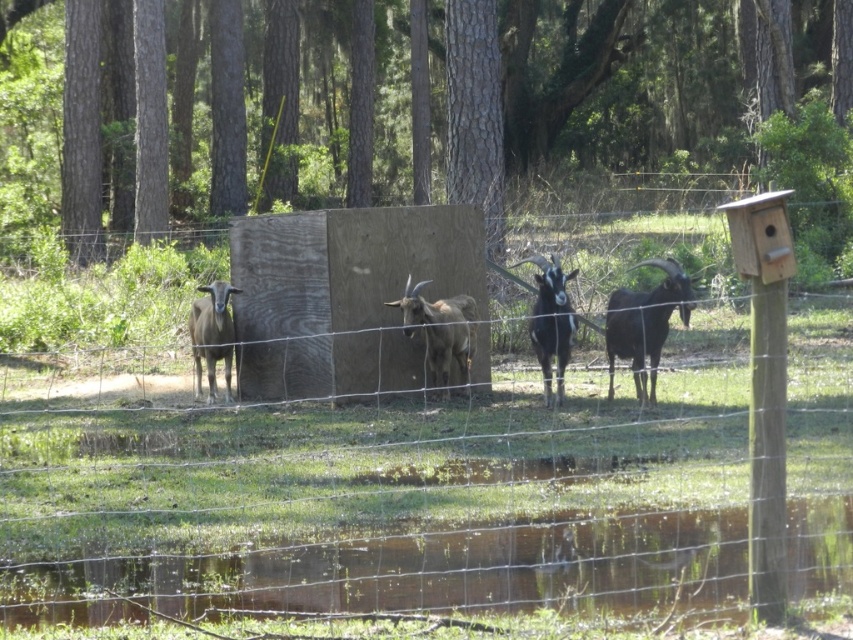
Question: Which point is farther to the camera?

Choices:
 (A) brown woolen goats at center
 (B) wooden fence at center
 (C) black woolly goat at right

Answer: (A)

Question: Is wooden fence at center to the right of brown woolly goat at left from the viewer's perspective?

Choices:
 (A) no
 (B) yes

Answer: (B)

Question: Among these points, which one is nearest to the camera?

Choices:
 (A) (659, 336)
 (B) (515, 266)
 (C) (688, 310)
 (D) (447, 307)

Answer: (C)

Question: Is brown woolen goat at center above black woolen goat at center?

Choices:
 (A) yes
 (B) no

Answer: (B)

Question: Does brown woolen goats at center have a greater width compared to brown woolly goat at left?

Choices:
 (A) no
 (B) yes

Answer: (B)

Question: Among these points, which one is farthest from the camera?

Choices:
 (A) (437, 333)
 (B) (229, 324)
 (C) (595, 504)

Answer: (B)